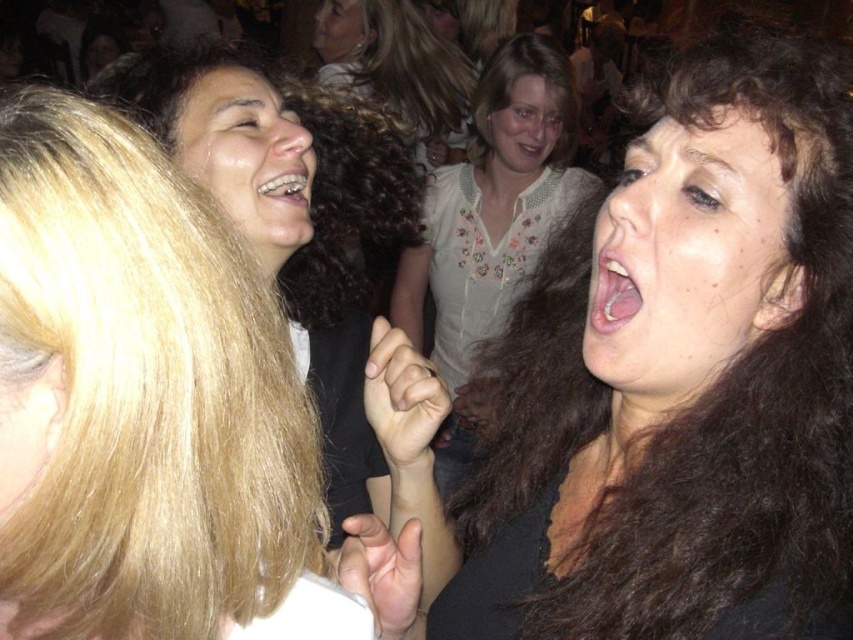
Between smooth skin face at center and smooth skin face at upper center, which one appears on the left side from the viewer's perspective?

smooth skin face at upper center is more to the left.

Between point (776, 177) and point (317, 44), which one is positioned behind?

Positioned behind is point (317, 44).

Describe the element at coordinates (688, 259) in the screenshot. This screenshot has width=853, height=640. I see `smooth skin face at center` at that location.

Where is `smooth skin face at center`? smooth skin face at center is located at coordinates (688, 259).

Looking at this image, who is lower down, smooth white blouse at center or smooth skin face at upper center?

smooth white blouse at center

Is smooth white blouse at center smaller than smooth skin face at upper center?

Yes.

Image resolution: width=853 pixels, height=640 pixels. I want to click on smooth white blouse at center, so (x=524, y=129).

Between blonde hair at left and metallic braces at mouth right, which one has less height?

metallic braces at mouth right

Who is lower down, blonde hair at left or metallic braces at mouth right?

blonde hair at left

Is point (149, 456) farther from camera compared to point (260, 179)?

No, it is in front of (260, 179).

In order to click on blonde hair at left in this screenshot , I will do `click(143, 392)`.